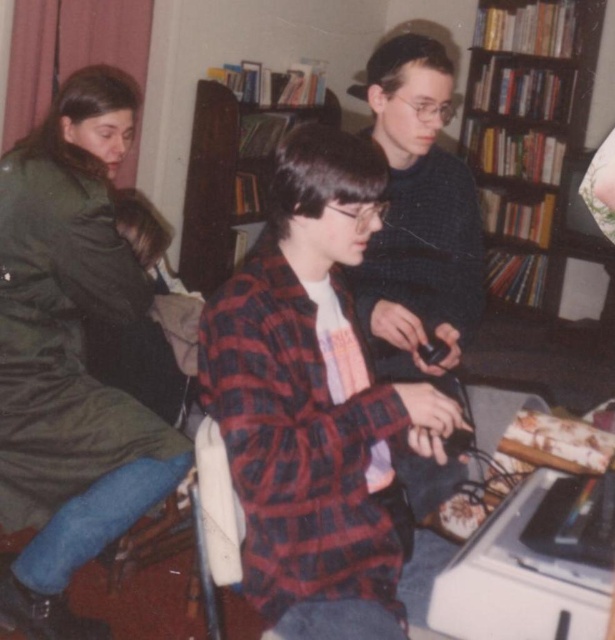
Question: From the image, what is the correct spatial relationship of green matte jacket at upper left in relation to dark brown wooden bookshelf at upper right?

Choices:
 (A) above
 (B) below

Answer: (B)

Question: Which point is farther from the camera taking this photo?

Choices:
 (A) (73, 348)
 (B) (192, 266)

Answer: (B)

Question: Which of these objects is positioned closest to the wooden bookshelf at center?

Choices:
 (A) red plaid shirt at center
 (B) green matte jacket at upper left
 (C) dark brown wooden bookshelf at upper right

Answer: (C)

Question: Which object is farther from the camera taking this photo?

Choices:
 (A) wooden bookshelf at center
 (B) red plaid shirt at center
 (C) green matte jacket at upper left
 (D) dark brown wooden bookshelf at upper right

Answer: (D)

Question: Can you confirm if green matte jacket at upper left is positioned to the left of dark brown wooden bookshelf at upper right?

Choices:
 (A) no
 (B) yes

Answer: (B)

Question: Does green matte jacket at upper left have a larger size compared to dark brown wooden bookshelf at upper right?

Choices:
 (A) yes
 (B) no

Answer: (B)